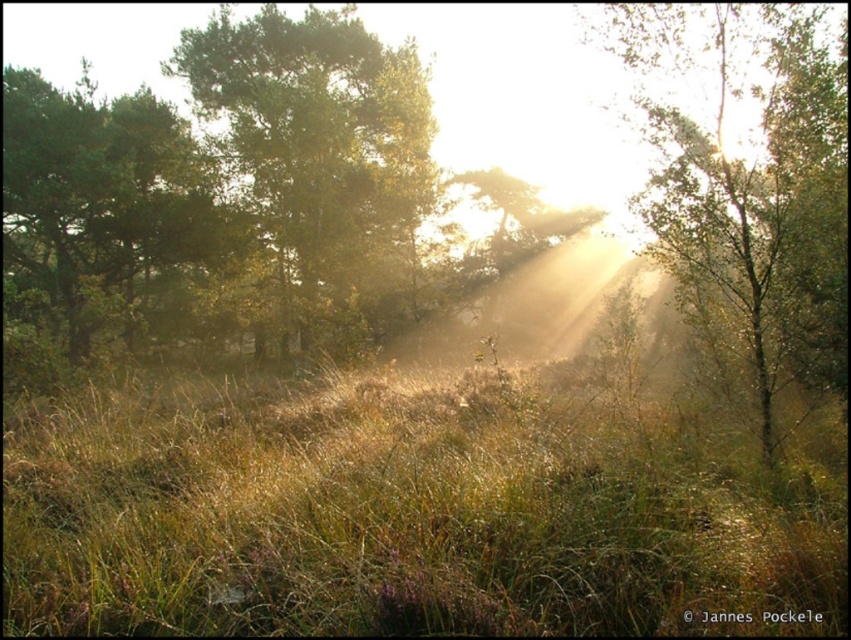
Does green grassy at center lie behind green matte tree at center?

That is False.

Who is more forward, (440, 470) or (389, 48)?

Positioned in front is point (440, 470).

Find the location of `green grassy at center`. green grassy at center is located at coordinates (415, 516).

You are a GUI agent. You are given a task and a screenshot of the screen. Output one action in this format:
    pyautogui.click(x=<x>, y=<y>)
    Task: Click on the green grassy at center
    This screenshot has width=851, height=640.
    Given the screenshot: What is the action you would take?
    [415, 516]

Which is above, green matte tree at center or green matte tree at left?

green matte tree at center is higher up.

Is green matte tree at center taller than green matte tree at left?

Correct, green matte tree at center is much taller as green matte tree at left.

This screenshot has width=851, height=640. Describe the element at coordinates (323, 156) in the screenshot. I see `green matte tree at center` at that location.

Find the location of a particular element. Image resolution: width=851 pixels, height=640 pixels. green matte tree at center is located at coordinates (323, 156).

Does point (766, 189) come behind point (180, 120)?

No.

Looking at this image, is green leafy tree at center wider than green matte tree at left?

Correct, the width of green leafy tree at center exceeds that of green matte tree at left.

Between point (764, 240) and point (164, 156), which one is positioned behind?

The point (164, 156) is more distant.

Where is `green leafy tree at center`? green leafy tree at center is located at coordinates (752, 179).